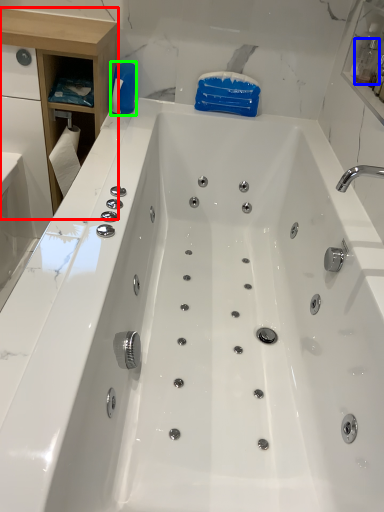
Question: Which object is the farthest from cabinetry (highlighted by a red box)? Choose among these: bottle (highlighted by a blue box) or cleaning product (highlighted by a green box).

Choices:
 (A) bottle
 (B) cleaning product

Answer: (A)